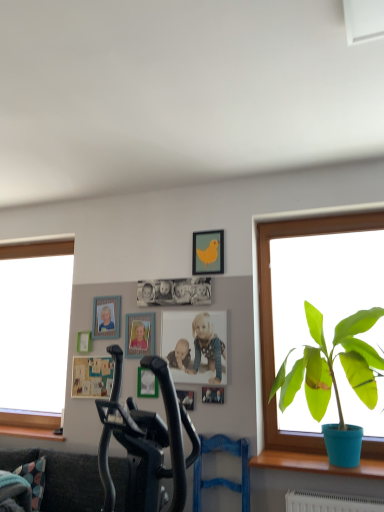
This screenshot has width=384, height=512. What do you see at coordinates (213, 395) in the screenshot? I see `metallic silver photo frame at center, acting as the first picture frame starting from the right` at bounding box center [213, 395].

Image resolution: width=384 pixels, height=512 pixels. What do you see at coordinates (92, 377) in the screenshot?
I see `wooden photo frame at lower left, the 2th picture frame in the left-to-right sequence` at bounding box center [92, 377].

Locate an element on the screen. The image size is (384, 512). green matte plant at right is located at coordinates (333, 375).

Image resolution: width=384 pixels, height=512 pixels. Find the location of `wooden at lower left`. wooden at lower left is located at coordinates (30, 432).

Find the location of a particular element. Image resolution: width=384 pixels, height=512 pixels. picture frame that is the 1st one when counting upward from the metallic silver picture frame at center, arranged as the fifth picture frame when viewed from the left (from the image's perspective) is located at coordinates (213, 395).

In terms of width, does metallic silver picture frame at center, arranged as the fifth picture frame when viewed from the left, look wider or thinner when compared to metallic silver photo frame at center, the 7th picture frame from the left?

metallic silver picture frame at center, arranged as the fifth picture frame when viewed from the left, is wider than metallic silver photo frame at center, the 7th picture frame from the left.

Which of these two, metallic silver picture frame at center, the 3th picture frame viewed from the right, or metallic silver photo frame at center, acting as the first picture frame starting from the right, stands taller?

With more height is metallic silver picture frame at center, the 3th picture frame viewed from the right.

Image resolution: width=384 pixels, height=512 pixels. In the image, there is a metallic silver picture frame at center, the 3th picture frame viewed from the right. In order to click on window sill below it (from a real-world perspective) in this screenshot , I will do `click(30, 432)`.

Which object is thinner, metallic silver picture frame at center, arranged as the fifth picture frame when viewed from the left, or wooden at lower left?

With smaller width is metallic silver picture frame at center, arranged as the fifth picture frame when viewed from the left.

Is point (177, 395) farther from viewer compared to point (41, 434)?

That is False.

Measure the distance between metallic silver picture frame at center, arranged as the fifth picture frame when viewed from the left, and wooden at lower left.

metallic silver picture frame at center, arranged as the fifth picture frame when viewed from the left, is 1.30 meters away from wooden at lower left.

Is metallic silver picture frame at center, the 3th picture frame viewed from the right, not within wooden photo frame at upper left, which is counted as the fifth picture frame, starting from the right?

metallic silver picture frame at center, the 3th picture frame viewed from the right, lies outside wooden photo frame at upper left, which is counted as the fifth picture frame, starting from the right,'s area.

Is metallic silver picture frame at center, arranged as the fifth picture frame when viewed from the left, turned away from wooden photo frame at upper left, which is counted as the fifth picture frame, starting from the right?

No, metallic silver picture frame at center, arranged as the fifth picture frame when viewed from the left, is not facing the opposite direction of wooden photo frame at upper left, which is counted as the fifth picture frame, starting from the right.

Does point (192, 397) appear closer or farther from the camera than point (105, 327)?

Point (192, 397) appears to be closer to the viewer than point (105, 327).

From the image's perspective, starting from the metallic silver picture frame at center, the 3th picture frame viewed from the right, which picture frame is the 5th one above? Please provide its 2D coordinates.

[(106, 317)]

Does metallic silver photo frame at center, acting as the first picture frame starting from the right, have a lesser height compared to blue fabric swivel chair at center?

Yes, metallic silver photo frame at center, acting as the first picture frame starting from the right, is shorter than blue fabric swivel chair at center.

Find the location of a particular element. The width and height of the screenshot is (384, 512). swivel chair to the left of metallic silver photo frame at center, the 7th picture frame from the left is located at coordinates (222, 478).

Can you see metallic silver photo frame at center, acting as the first picture frame starting from the right, touching blue fabric swivel chair at center?

There is a gap between metallic silver photo frame at center, acting as the first picture frame starting from the right, and blue fabric swivel chair at center.

Does metallic silver photo frame at center, acting as the first picture frame starting from the right, have a greater width compared to blue fabric swivel chair at center?

No.

Between point (62, 437) and point (315, 350), which one is positioned in front?

Point (315, 350)

From a real-world perspective, who is located higher, wooden at lower left or green matte plant at right?

green matte plant at right, from a real-world perspective.

Based on the photo, considering the relative positions of wooden at lower left and green matte plant at right in the image provided, is wooden at lower left to the left of green matte plant at right from the viewer's perspective?

Yes.

Considering the relative positions of wooden at lower left and green matte plant at right in the image provided, is wooden at lower left behind green matte plant at right?

Yes, wooden at lower left is further from the camera.

Is matte photo frame at center touching wooden picture frame at center, the 4th picture frame viewed from the right?

No.

Is wooden picture frame at center, acting as the fourth picture frame starting from the left, inside matte photo frame at center?

Actually, wooden picture frame at center, acting as the fourth picture frame starting from the left, is outside matte photo frame at center.

Is matte photo frame at center taller or shorter than wooden picture frame at center, the 4th picture frame viewed from the right?

Considering their sizes, matte photo frame at center has more height than wooden picture frame at center, the 4th picture frame viewed from the right.

Considering the positions of objects matte photo frame at center and wooden picture frame at center, the 4th picture frame viewed from the right, in the image provided, who is behind, matte photo frame at center or wooden picture frame at center, the 4th picture frame viewed from the right,?

wooden picture frame at center, the 4th picture frame viewed from the right.

This screenshot has height=512, width=384. What are the coordinates of `couch below the matte yellow picture frame at upper center, which ranks as the sixth picture frame in left-to-right order (from the image's perspective)` in the screenshot? It's located at (63, 479).

How different are the orientations of matte yellow picture frame at upper center, arranged as the second picture frame when viewed from the right, and dark gray fabric couch at lower left in degrees?

1.03 degrees separate the facing orientations of matte yellow picture frame at upper center, arranged as the second picture frame when viewed from the right, and dark gray fabric couch at lower left.

Could you tell me if matte yellow picture frame at upper center, arranged as the second picture frame when viewed from the right, is turned towards dark gray fabric couch at lower left?

No, matte yellow picture frame at upper center, arranged as the second picture frame when viewed from the right, is not aimed at dark gray fabric couch at lower left.

Is matte yellow picture frame at upper center, which ranks as the sixth picture frame in left-to-right order, next to dark gray fabric couch at lower left?

matte yellow picture frame at upper center, which ranks as the sixth picture frame in left-to-right order, and dark gray fabric couch at lower left are not in contact.

Starting from the metallic silver photo frame at center, acting as the first picture frame starting from the right, which picture frame is the 2nd one to the left? Please provide its 2D coordinates.

[(186, 399)]

This screenshot has width=384, height=512. What are the coordinates of `the 1st picture frame positioned above the wooden at lower left (from the image's perspective)` in the screenshot? It's located at (186, 399).

Based on their spatial positions, is wooden picture frame at center, the 4th picture frame viewed from the right, or wooden photo frame at upper left, the 3th picture frame in the left-to-right sequence, further from green matte plant at right?

wooden photo frame at upper left, the 3th picture frame in the left-to-right sequence.

Which object lies nearer to the anchor point matte photo frame at center, green matte plant at right or wooden photo frame at lower left, positioned as the sixth picture frame in right-to-left order?

green matte plant at right is closer to matte photo frame at center.

Considering their positions, is wooden picture frame at center, the 4th picture frame viewed from the right, positioned closer to wooden photo frame at lower left, positioned as the sixth picture frame in right-to-left order, than metallic silver picture frame at center, arranged as the fifth picture frame when viewed from the left?

The object closer to wooden photo frame at lower left, positioned as the sixth picture frame in right-to-left order, is wooden picture frame at center, the 4th picture frame viewed from the right.

Considering their positions, is wooden photo frame at upper left, which is counted as the fifth picture frame, starting from the right, positioned closer to wooden at lower left than blue fabric swivel chair at center?

wooden photo frame at upper left, which is counted as the fifth picture frame, starting from the right, is positioned closer to the anchor wooden at lower left.

Considering their positions, is wooden photo frame at lower left, the 2th picture frame in the left-to-right sequence, positioned further to metallic silver picture frame at center, arranged as the fifth picture frame when viewed from the left, than wooden at lower left?

wooden at lower left lies further to metallic silver picture frame at center, arranged as the fifth picture frame when viewed from the left, than the other object.

In the scene shown: Which object lies nearer to the anchor point wooden photo frame at lower left, positioned as the sixth picture frame in right-to-left order, blue fabric swivel chair at center or dark gray fabric couch at lower left?

dark gray fabric couch at lower left is positioned closer to the anchor wooden photo frame at lower left, positioned as the sixth picture frame in right-to-left order.

From the image, which object appears to be nearer to wooden photo frame at lower left, positioned as the sixth picture frame in right-to-left order, matte green picture frame at upper left, which ranks as the seventh picture frame in right-to-left order, or blue fabric swivel chair at center?

matte green picture frame at upper left, which ranks as the seventh picture frame in right-to-left order, lies closer to wooden photo frame at lower left, positioned as the sixth picture frame in right-to-left order, than the other object.

Considering their positions, is metallic silver picture frame at center, the 3th picture frame viewed from the right, positioned closer to metallic silver photo frame at center, acting as the first picture frame starting from the right, than wooden at lower left?

Among the two, metallic silver picture frame at center, the 3th picture frame viewed from the right, is located nearer to metallic silver photo frame at center, acting as the first picture frame starting from the right.

Find the location of `couch between wooden at lower left and green matte plant at right`. couch between wooden at lower left and green matte plant at right is located at coordinates (63, 479).

I want to click on picture frame located between blue fabric swivel chair at center and matte photo frame at center in the depth direction, so click(x=213, y=395).

The height and width of the screenshot is (512, 384). What are the coordinates of `person between blue fabric swivel chair at center and matte green picture frame at upper left, which ranks as the seventh picture frame in right-to-left order, along the z-axis` in the screenshot? It's located at (207, 347).

At what (x,y) coordinates should I click in order to perform the action: click on swivel chair positioned between dark gray fabric couch at lower left and metallic silver picture frame at center, the 3th picture frame viewed from the right, from near to far. Please return your answer as a coordinate pair (x, y). The image size is (384, 512). Looking at the image, I should click on (222, 478).